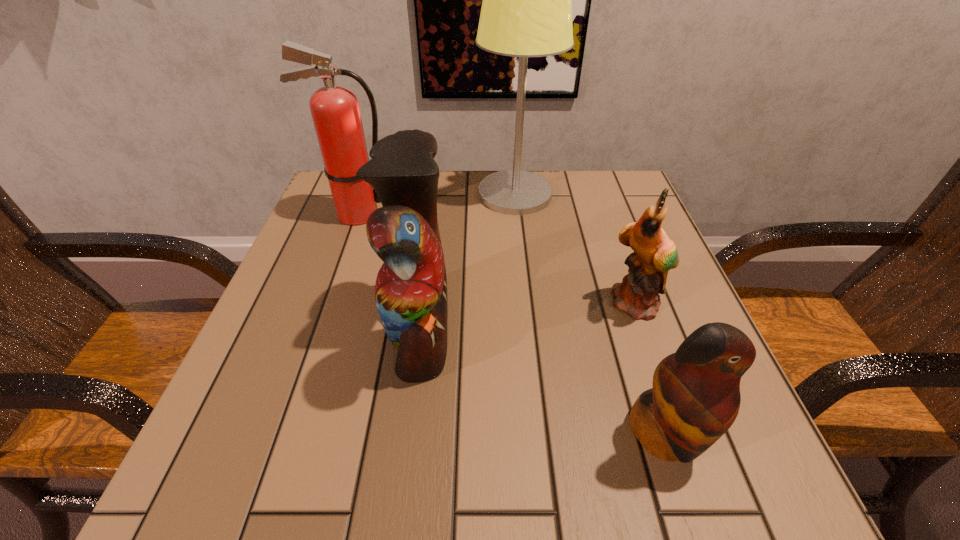
In order to click on table lamp in this screenshot , I will do `click(526, 11)`.

At what (x,y) coordinates should I click in order to perform the action: click on the tallest object. Please return your answer as a coordinate pair (x, y). The height and width of the screenshot is (540, 960). Looking at the image, I should click on (526, 11).

The height and width of the screenshot is (540, 960). Find the location of `the leftmost object`. the leftmost object is located at coordinates (335, 111).

Image resolution: width=960 pixels, height=540 pixels. What are the coordinates of `the tallest parrot` in the screenshot? It's located at [x=411, y=286].

The width and height of the screenshot is (960, 540). I want to click on the second object from left to right, so click(411, 286).

Identify the location of the nearest parrot. (695, 398).

The width and height of the screenshot is (960, 540). I want to click on vacant space located 0.320m on the left of the table lamp, so click(347, 194).

Where is `vacant position located on the hose direction of the fire extinguisher`? vacant position located on the hose direction of the fire extinguisher is located at coordinates (470, 214).

Locate an element on the screen. The width and height of the screenshot is (960, 540). free space located at the face of the tallest parrot is located at coordinates (616, 329).

What are the coordinates of `table lamp positioned at the far edge` in the screenshot? It's located at (526, 11).